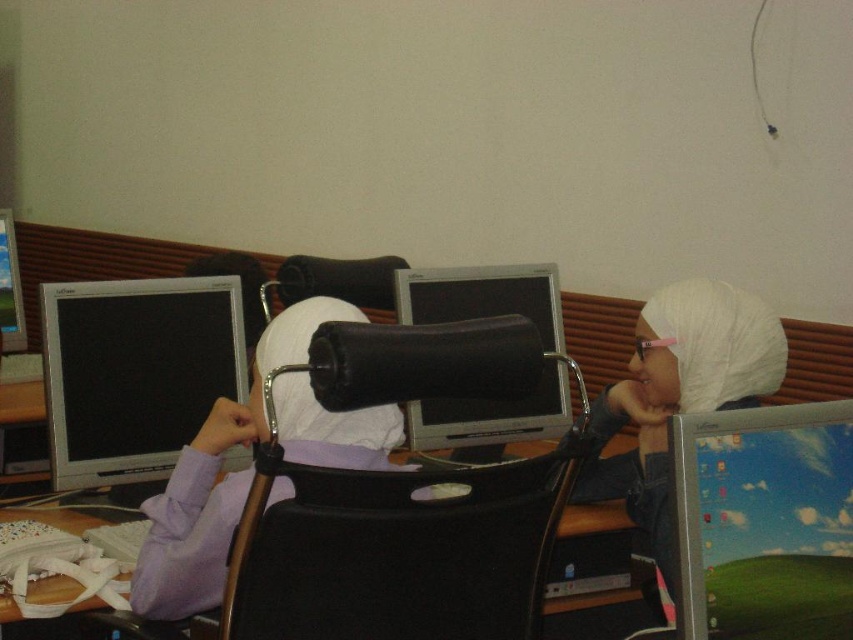
Question: Which object appears closest to the camera in this image?

Choices:
 (A) matte black monitor at center
 (B) purple fabric headscarf at center
 (C) white matte hijab at center

Answer: (B)

Question: Is matte black monitor at left to the right of matte black monitor at center from the viewer's perspective?

Choices:
 (A) yes
 (B) no

Answer: (B)

Question: Which point is closer to the camera?

Choices:
 (A) [151, 460]
 (B) [712, 372]

Answer: (B)

Question: Where is matte black monitor at left located in relation to white matte hijab at center in the image?

Choices:
 (A) below
 (B) above

Answer: (B)

Question: Can you confirm if purple fabric headscarf at center is smaller than white matte hijab at center?

Choices:
 (A) yes
 (B) no

Answer: (A)

Question: Estimate the real-world distances between objects in this image. Which object is closer to the matte black monitor at left?

Choices:
 (A) white matte hijab at center
 (B) matte black monitor at center

Answer: (B)